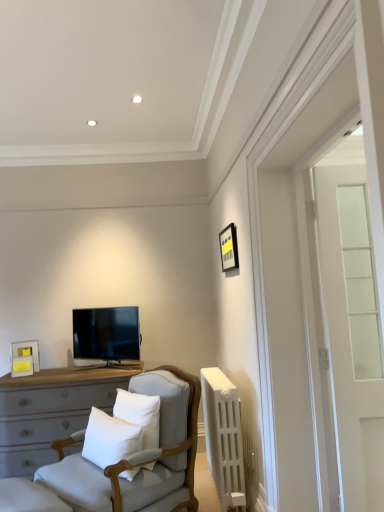
Question: From the image's perspective, relative to clear glass door at right, is light gray fabric chair at center above or below?

Choices:
 (A) above
 (B) below

Answer: (B)

Question: Looking at their shapes, would you say light gray fabric chair at center is wider or thinner than clear glass door at right?

Choices:
 (A) wide
 (B) thin

Answer: (A)

Question: Which object is positioned closest to the clear glass door at right?

Choices:
 (A) white plastic radiator at right
 (B) white cotton pillow at center, the 1th pillow positioned from the left
 (C) matte white picture frame at left, which appears as the 2th picture frame when viewed from the right
 (D) matte black tv at center
 (E) white soft cushion at center, which is the 1th pillow from right to left

Answer: (A)

Question: Based on their relative distances, which object is nearer to the matte black tv at center?

Choices:
 (A) matte black picture frame at upper right, which is the first picture frame in right-to-left order
 (B) matte white picture frame at left, the second picture frame in the front-to-back sequence
 (C) clear glass door at right
 (D) light gray fabric chair at center
 (E) white cotton pillow at center, the 2th pillow from the right

Answer: (B)